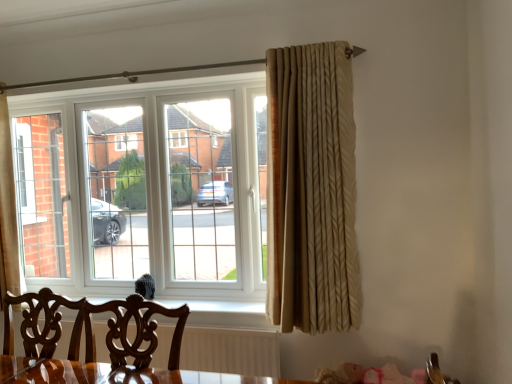
Question: Can you confirm if mahogany wood chair at lower center is positioned to the left of mahogany wood swivel chair at lower left?

Choices:
 (A) no
 (B) yes

Answer: (A)

Question: Considering the relative sizes of mahogany wood chair at lower center and mahogany wood swivel chair at lower left in the image provided, is mahogany wood chair at lower center smaller than mahogany wood swivel chair at lower left?

Choices:
 (A) no
 (B) yes

Answer: (B)

Question: Does mahogany wood chair at lower center have a greater height compared to mahogany wood swivel chair at lower left?

Choices:
 (A) yes
 (B) no

Answer: (B)

Question: From a real-world perspective, does mahogany wood chair at lower center stand above mahogany wood swivel chair at lower left?

Choices:
 (A) no
 (B) yes

Answer: (B)

Question: Could mahogany wood swivel chair at lower left be considered to be inside mahogany wood chair at lower center?

Choices:
 (A) yes
 (B) no

Answer: (B)

Question: Can you confirm if mahogany wood chair at lower center is wider than mahogany wood swivel chair at lower left?

Choices:
 (A) no
 (B) yes

Answer: (B)

Question: From a real-world perspective, is mahogany wood swivel chair at lower left on beige textured curtain at right?

Choices:
 (A) no
 (B) yes

Answer: (A)

Question: Is mahogany wood swivel chair at lower left oriented away from beige textured curtain at right?

Choices:
 (A) no
 (B) yes

Answer: (A)

Question: Is beige textured curtain at right located within mahogany wood swivel chair at lower left?

Choices:
 (A) no
 (B) yes

Answer: (A)

Question: From the image's perspective, is mahogany wood swivel chair at lower left beneath beige textured curtain at right?

Choices:
 (A) yes
 (B) no

Answer: (A)

Question: Is mahogany wood swivel chair at lower left smaller than beige textured curtain at right?

Choices:
 (A) yes
 (B) no

Answer: (A)

Question: Are mahogany wood swivel chair at lower left and beige textured curtain at right beside each other?

Choices:
 (A) no
 (B) yes

Answer: (A)

Question: Is beige textured curtain at right taller than mahogany wood swivel chair at lower left?

Choices:
 (A) yes
 (B) no

Answer: (A)